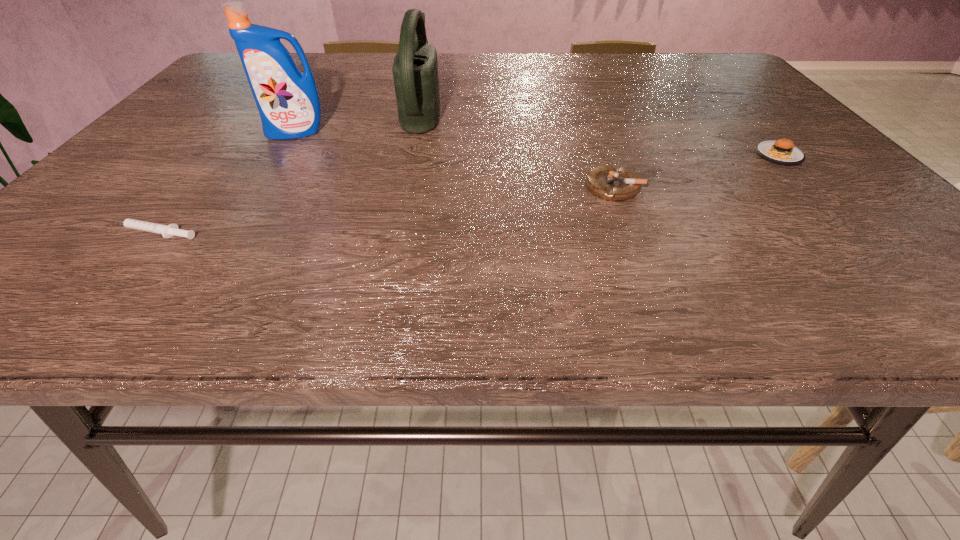
You are a GUI agent. You are given a task and a screenshot of the screen. Output one action in this format:
    pyautogui.click(x=<x>, y=<y>)
    Task: Click on the vacant region that satisfies the following two spatial constraints: 1. on the spout of the third object from left to right; 2. on the right side of the ashtray
    This screenshot has height=540, width=960.
    Given the screenshot: What is the action you would take?
    pyautogui.click(x=406, y=187)

The height and width of the screenshot is (540, 960). Identify the location of free space in the image that satisfies the following two spatial constraints: 1. on the label of the detergent; 2. on the left side of the food. (282, 156).